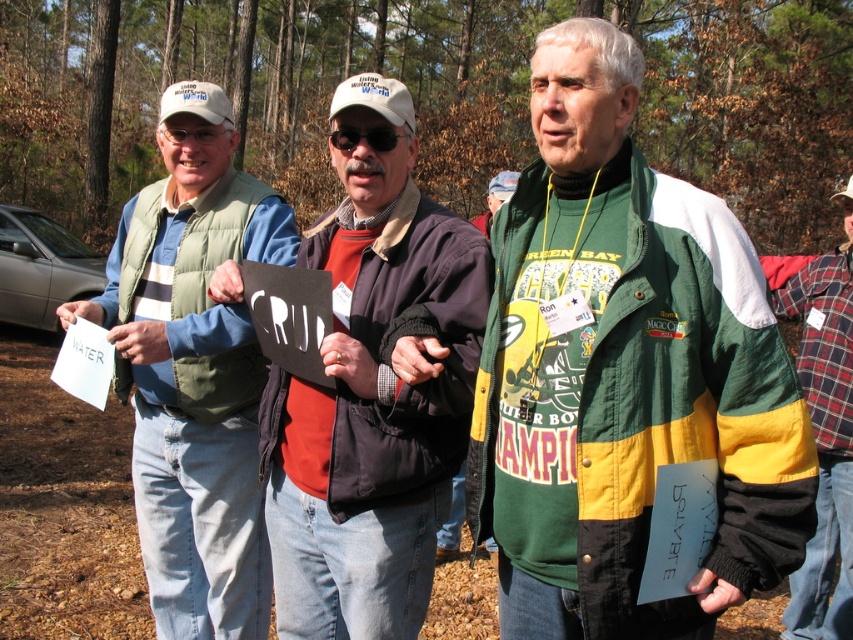
Which is more to the right, green matte vest at left or flannel shirt at center?

flannel shirt at center

Where is `green matte vest at left`? The width and height of the screenshot is (853, 640). green matte vest at left is located at coordinates (194, 371).

Identify the location of green matte vest at left. (194, 371).

Is dark brown leather jacket at center to the right of flannel shirt at center from the viewer's perspective?

No, dark brown leather jacket at center is not to the right of flannel shirt at center.

Can you confirm if dark brown leather jacket at center is positioned below flannel shirt at center?

No.

Is point (340, 605) positioned behind point (843, 214)?

No.

You are a GUI agent. You are given a task and a screenshot of the screen. Output one action in this format:
    pyautogui.click(x=<x>, y=<y>)
    Task: Click on the dark brown leather jacket at center
    This screenshot has width=853, height=640.
    Given the screenshot: What is the action you would take?
    [372, 388]

Between green/yellow/white jacket at center and flannel shirt at center, which one has more height?

Standing taller between the two is flannel shirt at center.

Is green/yellow/white jacket at center wider than flannel shirt at center?

Yes, green/yellow/white jacket at center is wider than flannel shirt at center.

Is point (592, 451) closer to camera compared to point (828, 337)?

Yes, point (592, 451) is closer to viewer.

I want to click on green/yellow/white jacket at center, so click(625, 372).